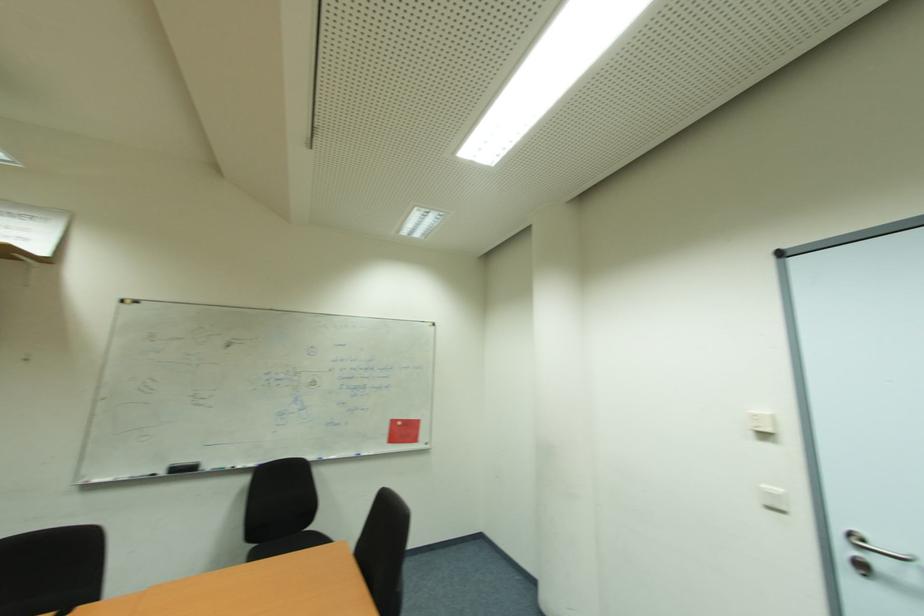
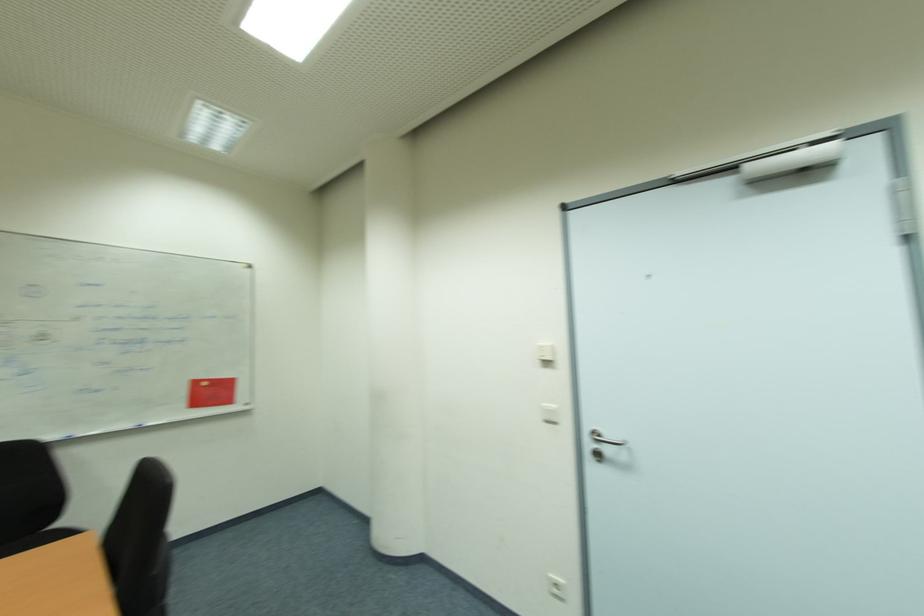
Find the pixel in the second image that matches (x=784, y=492) in the first image.

(556, 407)